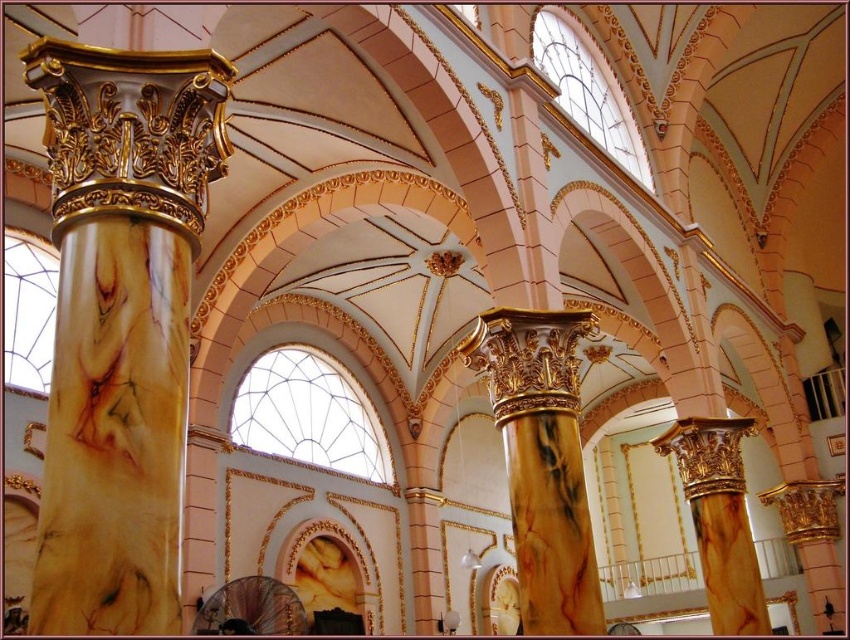
Question: Can you confirm if marble column at left is wider than marble column at right?

Choices:
 (A) yes
 (B) no

Answer: (B)

Question: Is the position of marble column at left less distant than that of marble column at center?

Choices:
 (A) yes
 (B) no

Answer: (A)

Question: Which point is farther to the camera?

Choices:
 (A) marble column at right
 (B) marble column at center
 (C) marble column at left

Answer: (A)

Question: Which point appears closest to the camera in this image?

Choices:
 (A) (47, 516)
 (B) (510, 369)

Answer: (A)

Question: Can you confirm if marble column at left is positioned to the right of marble column at right?

Choices:
 (A) no
 (B) yes

Answer: (A)

Question: Considering the real-world distances, which object is farthest from the marble column at left?

Choices:
 (A) marble column at right
 (B) marble column at center

Answer: (A)